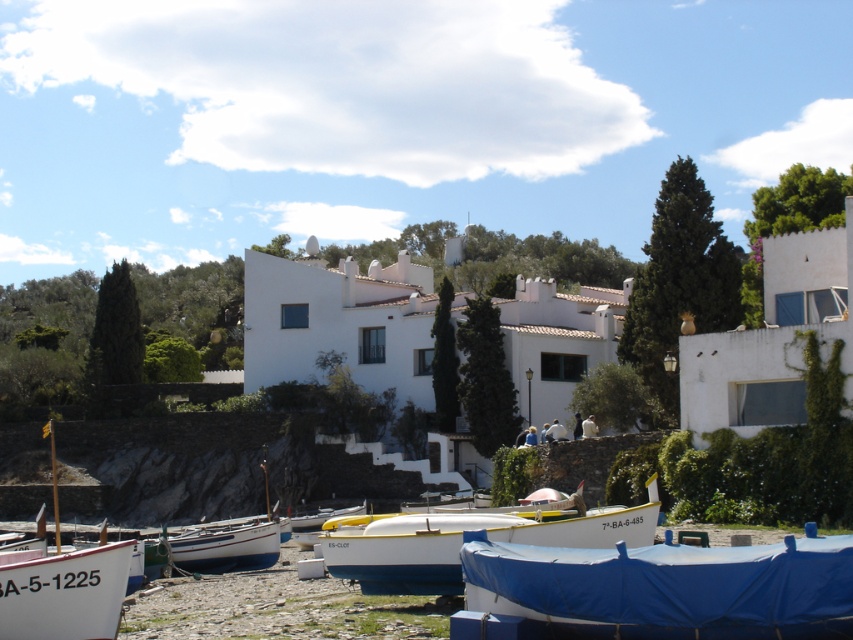
Question: Which object is the closest to the white matte boat at lower left?

Choices:
 (A) white plastic boat at center
 (B) white wooden boat at lower left
 (C) blue tarpaulin boat at lower center

Answer: (C)

Question: Which of these objects is positioned farthest from the white plastic boat at center?

Choices:
 (A) white matte boat at lower left
 (B) blue tarpaulin boat at lower center

Answer: (A)

Question: Is white matte boat at lower left thinner than white wooden boat at lower left?

Choices:
 (A) no
 (B) yes

Answer: (A)

Question: Is white matte boat at lower left to the right of white wooden boat at lower left from the viewer's perspective?

Choices:
 (A) yes
 (B) no

Answer: (B)

Question: Estimate the real-world distances between objects in this image. Which object is closer to the white plastic boat at center?

Choices:
 (A) white matte boat at lower left
 (B) white wooden boat at lower left
 (C) blue tarpaulin boat at lower center

Answer: (C)

Question: Does blue tarpaulin boat at lower center have a greater width compared to white plastic boat at center?

Choices:
 (A) no
 (B) yes

Answer: (A)